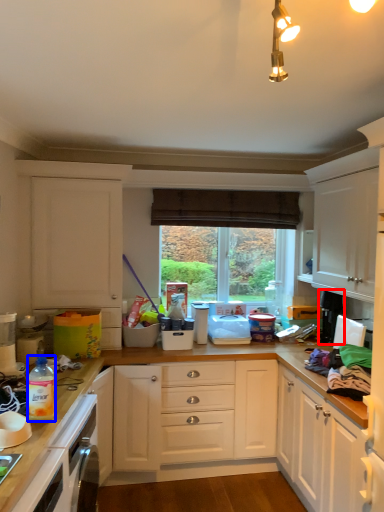
Question: Which object is further to the camera taking this photo, appliance (highlighted by a red box) or bottle (highlighted by a blue box)?

Choices:
 (A) appliance
 (B) bottle

Answer: (A)